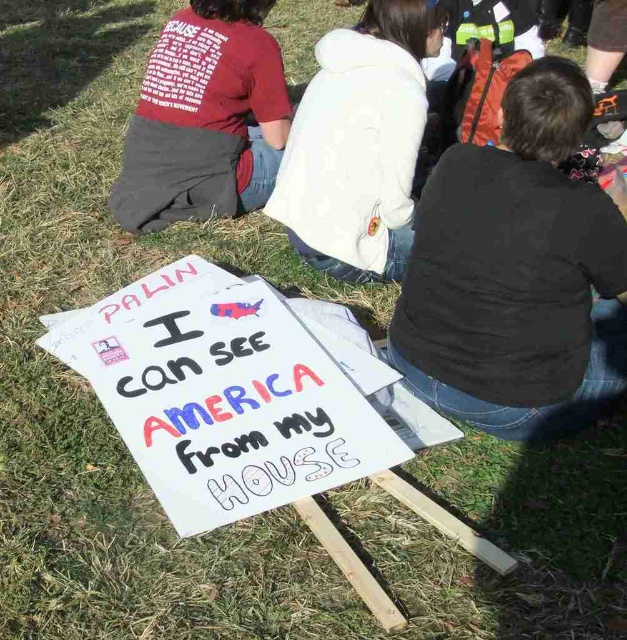
You are a photographer trying to capture a clear photo of the white paper sign at center and the white fleece jacket at center. Since the sign is larger than the jacket, which object will require you to step back more to ensure it fits entirely in the frame?

The white paper sign at center is larger in size than the white fleece jacket at center, so you will need to step back more to capture the white paper sign at center in its entirety.

You are a photographer standing at the edge of the grassy area where the group is gathered. You want to take a photo of the white paper sign at center so that it is clearly visible in the frame. The camera you are using has a minimum focusing distance of 5 feet. Will you need to move closer or farther away to ensure the sign is in focus?

The white paper sign at center is 4.76 feet away. Since the camera requires a minimum focusing distance of 5 feet, you need to move 0.24 feet farther away to ensure the sign is in focus.